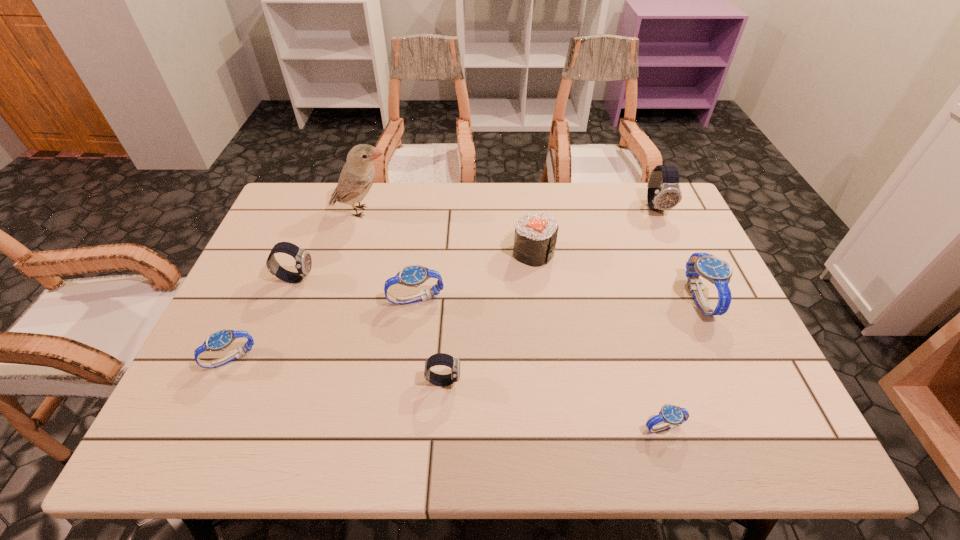
The image size is (960, 540). I want to click on the nearest dark watch, so click(443, 359).

At what (x,y) coordinates should I click in order to perform the action: click on the second dark watch from left to right. Please return your answer as a coordinate pair (x, y). The image size is (960, 540). Looking at the image, I should click on (443, 359).

Where is `the second smallest blue watch`? The image size is (960, 540). the second smallest blue watch is located at coordinates (219, 340).

Where is `the second nearest blue watch`? The image size is (960, 540). the second nearest blue watch is located at coordinates (219, 340).

You are a GUI agent. You are given a task and a screenshot of the screen. Output one action in this format:
    pyautogui.click(x=<x>, y=<y>)
    Task: Click on the third object from right to left
    This screenshot has height=540, width=960.
    Given the screenshot: What is the action you would take?
    pyautogui.click(x=670, y=415)

I want to click on the third blue watch from left to right, so click(x=670, y=415).

Locate an element on the screen. vacant space located 0.170m at the face of the bird is located at coordinates (446, 212).

This screenshot has height=540, width=960. Identify the location of vacant space located 0.320m on the face of the farthest watch. (697, 296).

Find the location of a particular element. blank space located on the face of the second farthest dark watch is located at coordinates (350, 278).

Locate an element on the screen. Image resolution: width=960 pixels, height=540 pixels. vacant space located on the front of the third farthest object is located at coordinates (540, 302).